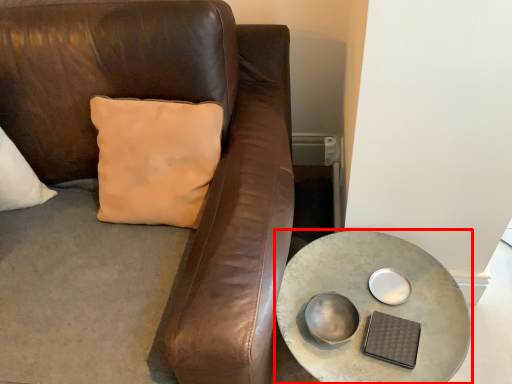
Question: Considering the relative positions of table (annotated by the red box) and bowl in the image provided, where is table (annotated by the red box) located with respect to the staircase?

Choices:
 (A) left
 (B) right

Answer: (B)